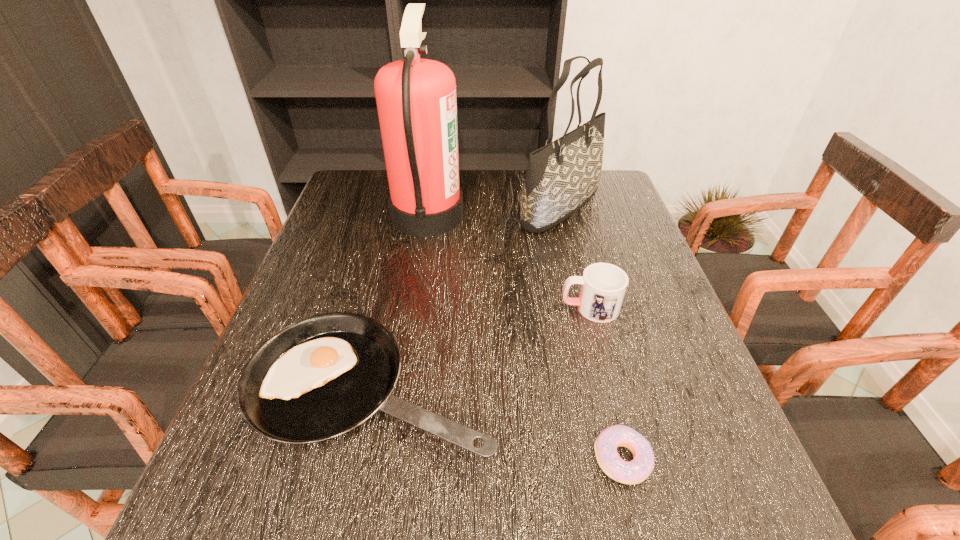
The image size is (960, 540). In order to click on vacant position in the image that satisfies the following two spatial constraints: 1. on the front side of the tote bag; 2. at the nozzle of the fire extinguisher in this screenshot , I will do `click(563, 215)`.

Image resolution: width=960 pixels, height=540 pixels. What are the coordinates of `free space that satisfies the following two spatial constraints: 1. at the nozzle of the doughnut; 2. on the left side of the fire extinguisher` in the screenshot? It's located at (390, 459).